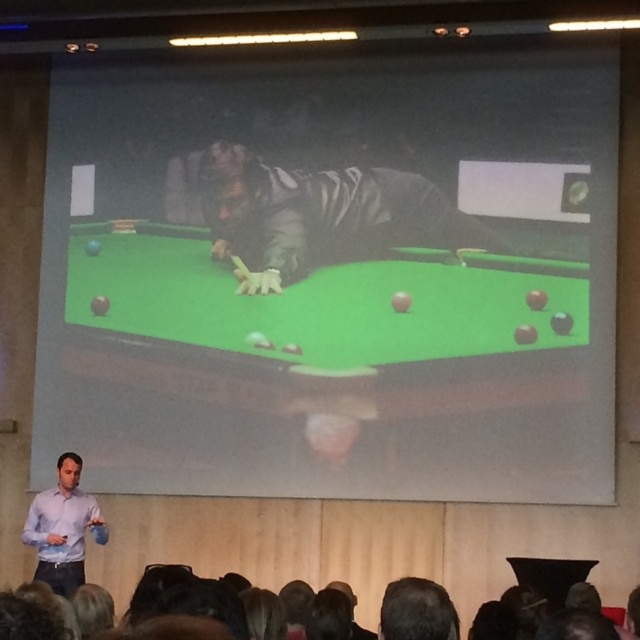
Between dark matte jacket at center and light purple shirt at lower left, which one is positioned higher?

dark matte jacket at center

Looking at this image, how distant is dark matte jacket at center from light purple shirt at lower left?

dark matte jacket at center is 8.27 feet away from light purple shirt at lower left.

Is point (394, 209) closer to camera compared to point (99, 509)?

No, (394, 209) is behind (99, 509).

This screenshot has width=640, height=640. I want to click on dark matte jacket at center, so click(321, 216).

Between point (88, 225) and point (339, 260), which one is positioned behind?

The point (88, 225) is behind.

Is point (314, 310) closer to viewer compared to point (202, 173)?

That is True.

The image size is (640, 640). What are the coordinates of `green felt billiard table at center` in the screenshot? It's located at pos(321,300).

Find the location of a particular element. This screenshot has width=640, height=640. green felt billiard table at center is located at coordinates (321, 300).

Consider the image. Who is positioned more to the right, green felt billiard table at center or light purple shirt at lower left?

green felt billiard table at center is more to the right.

Does point (516, 257) come closer to viewer compared to point (49, 515)?

That is False.

I want to click on green felt billiard table at center, so click(321, 300).